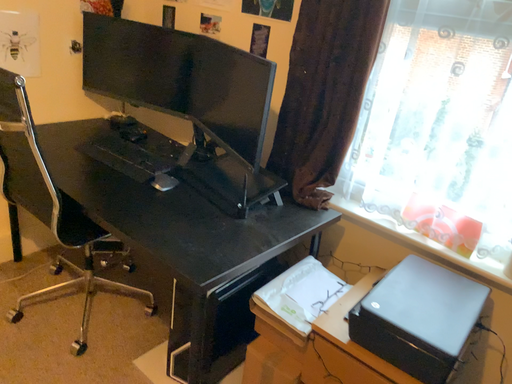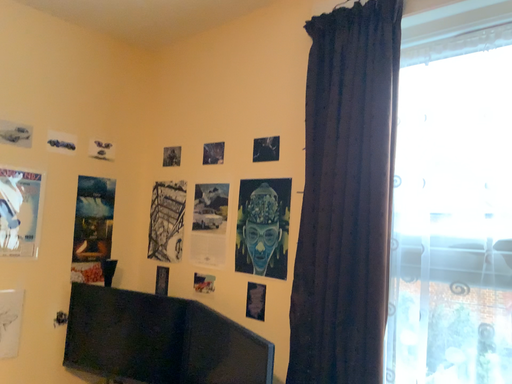
Question: Which way did the camera rotate in the video?

Choices:
 (A) rotated upward
 (B) rotated downward

Answer: (A)